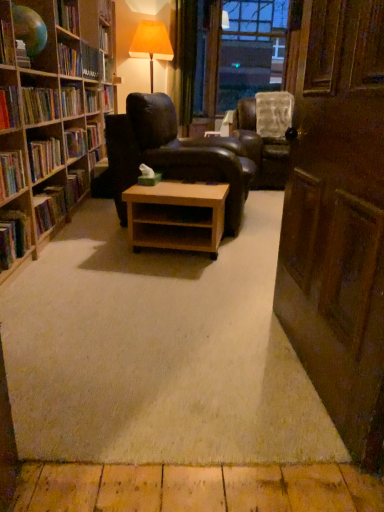
Where is `free space in front of leather armchair at center, acting as the second chair starting from the right`? The height and width of the screenshot is (512, 384). free space in front of leather armchair at center, acting as the second chair starting from the right is located at coordinates (162, 260).